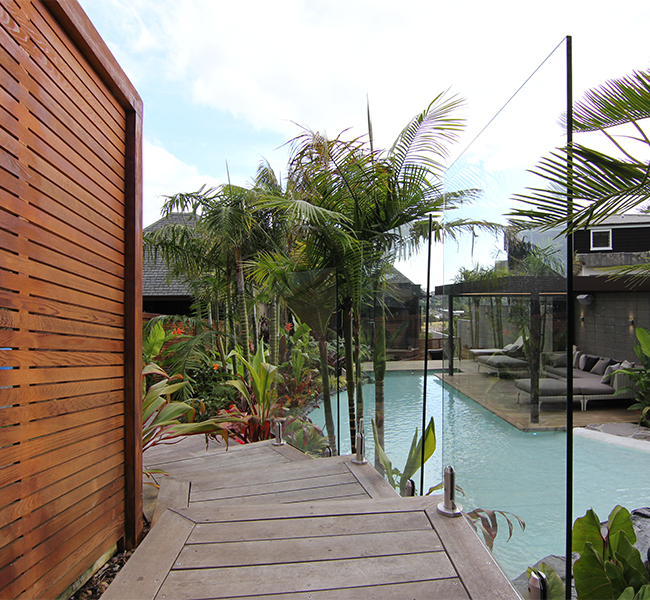
Identify the location of couch. click(558, 366).